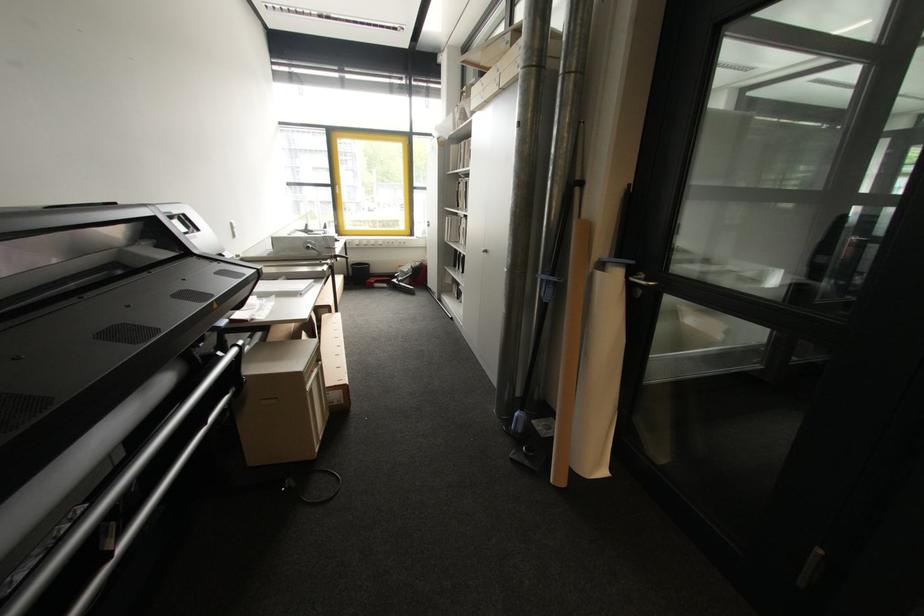
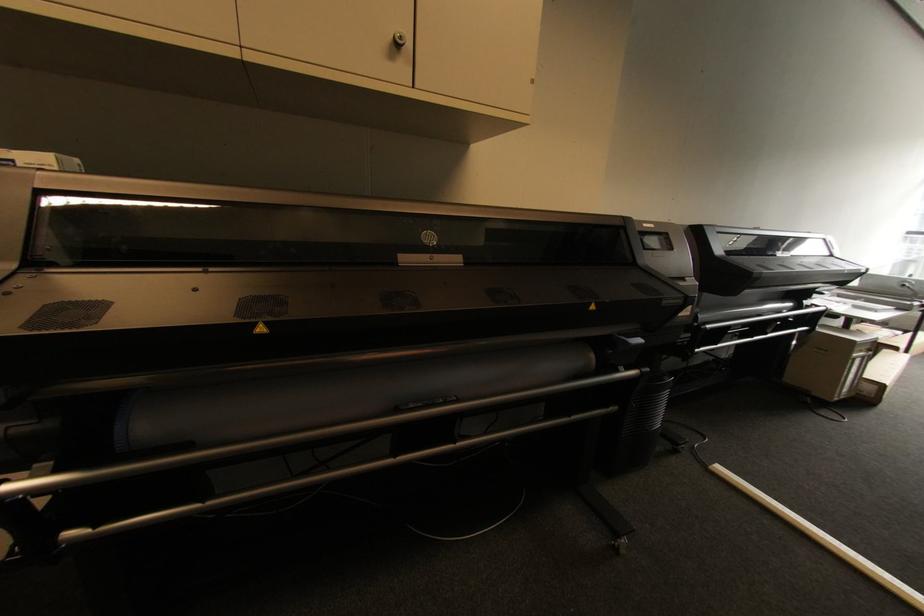
Find the pixel in the second image that matches (315,371) in the first image.

(867, 352)